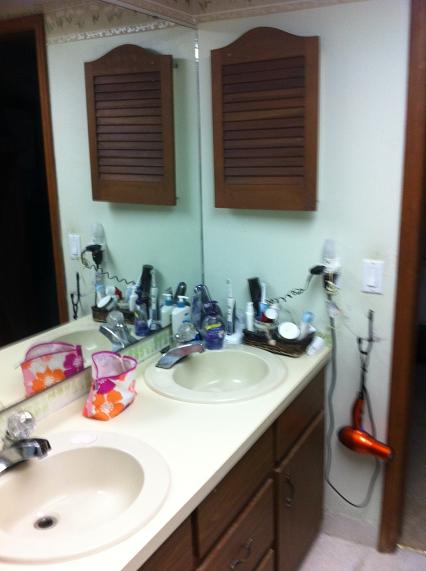
You are a GUI agent. You are given a task and a screenshot of the screen. Output one action in this format:
    pyautogui.click(x=<x>, y=<y>)
    Task: Click on the white wall switch
    
    Given the screenshot: What is the action you would take?
    pyautogui.click(x=371, y=279)